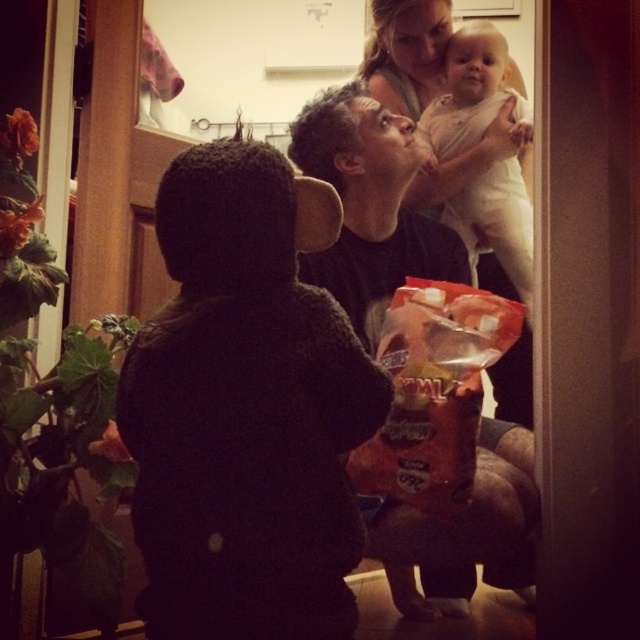
Question: Which point is closer to the camera?

Choices:
 (A) matte black shirt at center
 (B) white cloth baby at upper center

Answer: (A)

Question: Does matte black shirt at center appear on the left side of white cloth baby at upper center?

Choices:
 (A) no
 (B) yes

Answer: (B)

Question: Does matte black shirt at center appear under white cloth baby at upper center?

Choices:
 (A) no
 (B) yes

Answer: (B)

Question: Can you confirm if matte black shirt at center is positioned to the left of white cloth baby at upper center?

Choices:
 (A) yes
 (B) no

Answer: (A)

Question: Which of the following is the closest to the observer?

Choices:
 (A) [392, 172]
 (B) [477, 64]

Answer: (A)